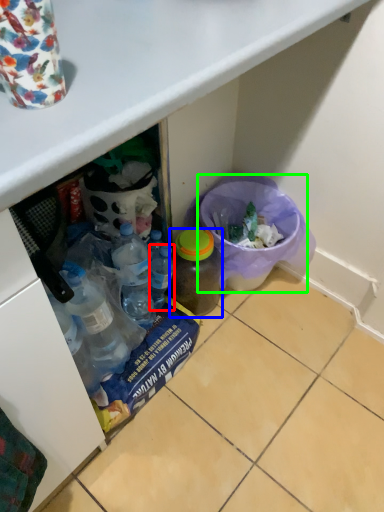
Question: Which object is the farthest from bottle (highlighted by a red box)? Choose among these: bottle (highlighted by a blue box) or recycling bin (highlighted by a green box).

Choices:
 (A) bottle
 (B) recycling bin

Answer: (B)